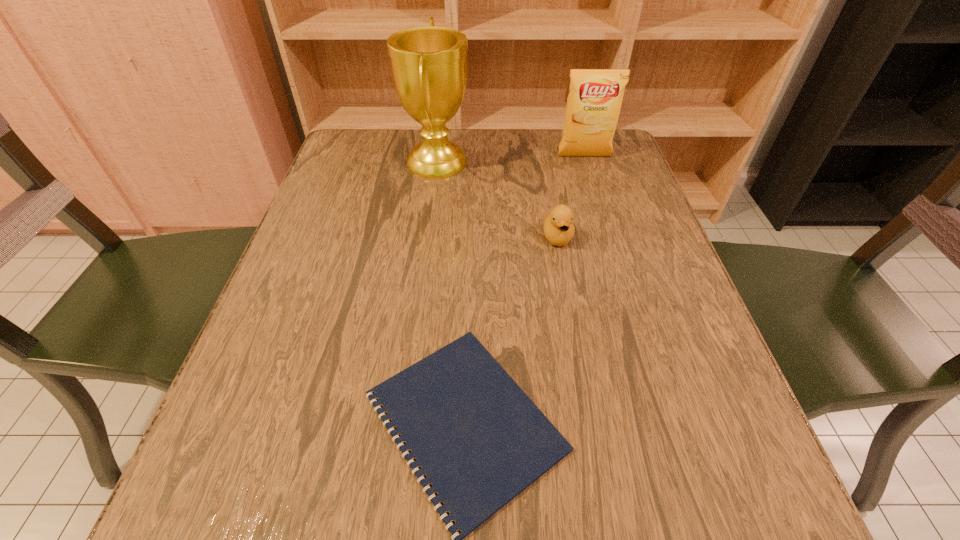
I want to click on object present at the right edge, so click(593, 106).

Image resolution: width=960 pixels, height=540 pixels. I want to click on object present at the far right corner, so coord(593,106).

In the image, there is a desktop. Identify the location of free region at the far edge. (520, 134).

You are a GUI agent. You are given a task and a screenshot of the screen. Output one action in this format:
    pyautogui.click(x=<x>, y=<y>)
    Task: Click on the free space at the left edge of the desktop
    Image resolution: width=960 pixels, height=540 pixels.
    Given the screenshot: What is the action you would take?
    pyautogui.click(x=275, y=366)

Locate an element on the screen. The image size is (960, 540). vacant space at the right edge is located at coordinates click(x=653, y=414).

The width and height of the screenshot is (960, 540). In order to click on vacant space at the far left corner of the desktop in this screenshot , I will do `click(368, 131)`.

This screenshot has height=540, width=960. In order to click on free area in between the second nearest object and the crisp (potato chip) in this screenshot , I will do `click(571, 197)`.

Locate an element on the screen. The width and height of the screenshot is (960, 540). vacant area that lies between the rightmost object and the award is located at coordinates (511, 159).

Locate an element on the screen. This screenshot has width=960, height=540. free point between the second shortest object and the third shortest object is located at coordinates (571, 197).

Find the location of a particular element. The width and height of the screenshot is (960, 540). unoccupied position between the tallest object and the crisp (potato chip) is located at coordinates (511, 159).